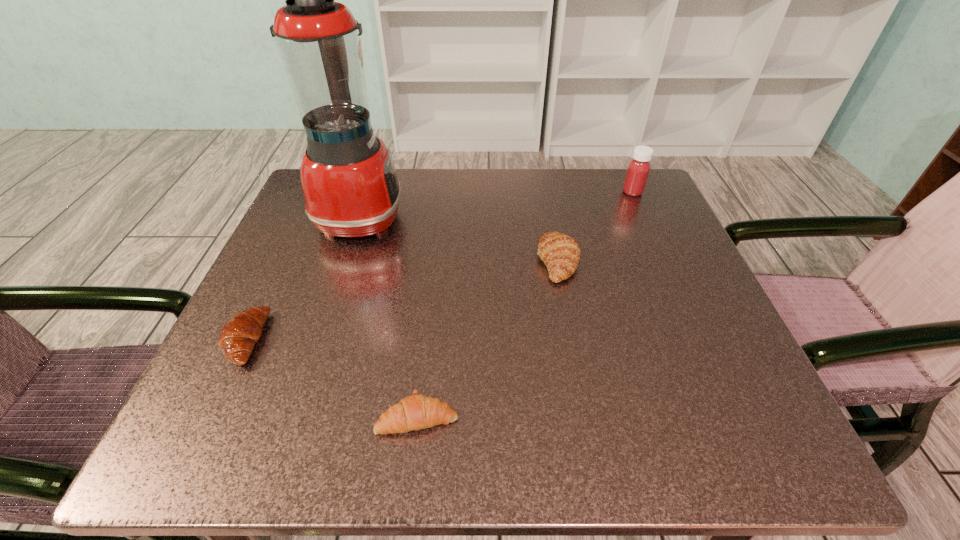
Image resolution: width=960 pixels, height=540 pixels. I want to click on crescent roll that stands as the third closest to the rightmost object, so click(240, 333).

Find the location of a particular element. The width and height of the screenshot is (960, 540). crescent roll that stands as the second closest to the leftmost crescent roll is located at coordinates (560, 253).

You are a GUI agent. You are given a task and a screenshot of the screen. Output one action in this format:
    pyautogui.click(x=<x>, y=<y>)
    Task: Click on the free region that satisfies the following two spatial constraints: 1. on the controls of the tallest object; 2. on the front side of the fourth farthest object
    The height and width of the screenshot is (540, 960).
    Given the screenshot: What is the action you would take?
    pyautogui.click(x=321, y=339)

Identify the location of vacant space that satisfies the following two spatial constraints: 1. on the controls of the food processor; 2. on the back side of the farthest crescent roll. Image resolution: width=960 pixels, height=540 pixels. click(x=346, y=261).

Image resolution: width=960 pixels, height=540 pixels. I want to click on vacant region that satisfies the following two spatial constraints: 1. on the controls of the tallest object; 2. on the right side of the second object from right to left, so click(346, 261).